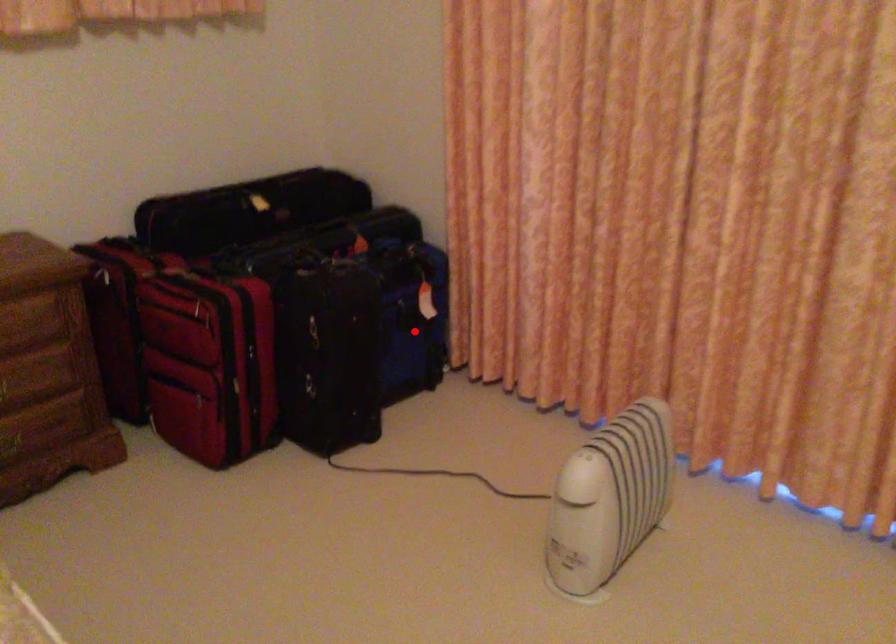
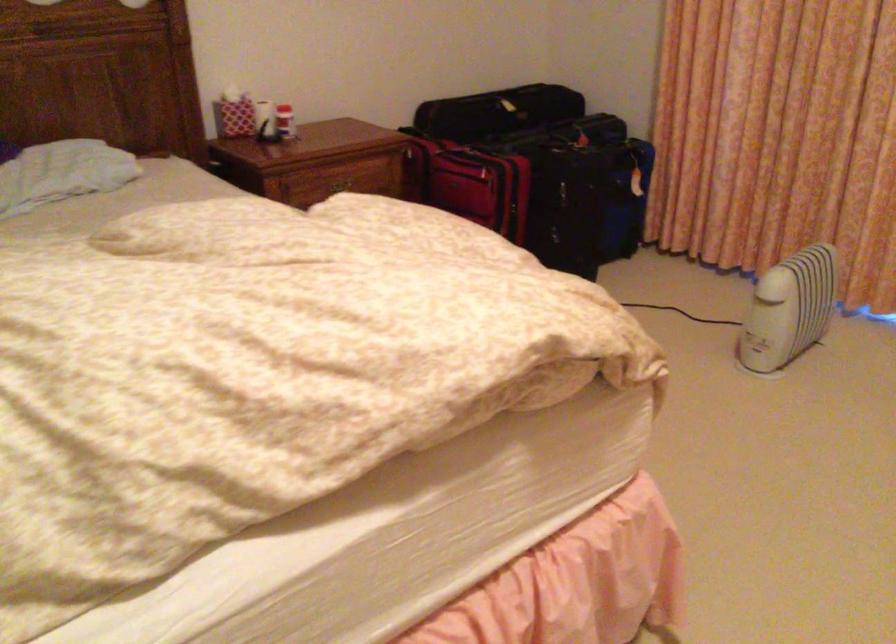
Question: I am providing you with two images of the same scene from different viewpoints. A red point is shown in image1. For the corresponding object point in image2, is it positioned nearer or farther from the camera?

Choices:
 (A) Nearer
 (B) Farther

Answer: (B)